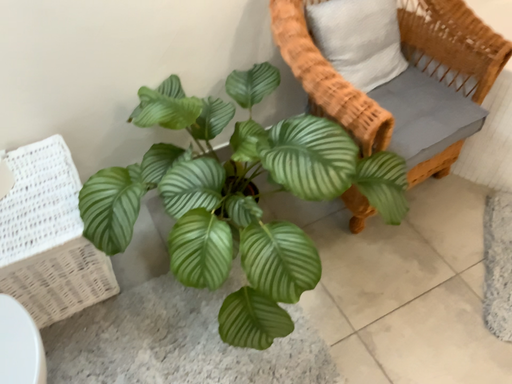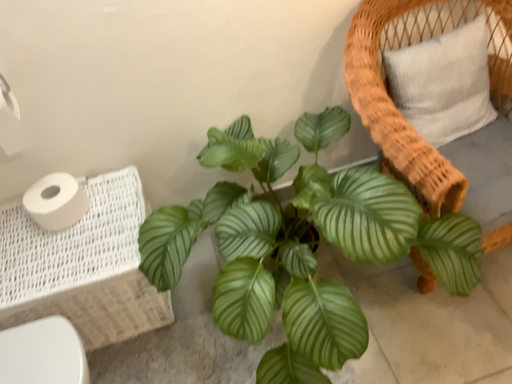
Question: Which way did the camera rotate in the video?

Choices:
 (A) rotated left
 (B) rotated right

Answer: (A)